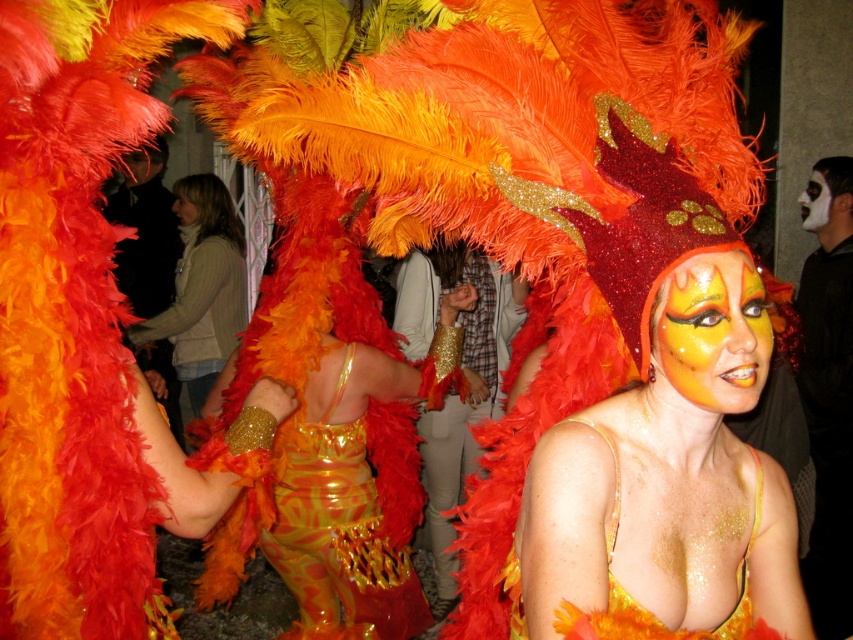
Question: Which of the following is the farthest from the observer?

Choices:
 (A) matte orange feather boa at center
 (B) shiny gold dress at center
 (C) shiny gold costume at center

Answer: (A)

Question: Is shiny gold costume at center in front of matte black face at center?

Choices:
 (A) no
 (B) yes

Answer: (B)

Question: Is shiny gold dress at center thinner than shiny gold face paint at center?

Choices:
 (A) yes
 (B) no

Answer: (B)

Question: Which object is farther from the camera taking this photo?

Choices:
 (A) white matte face at center
 (B) shiny gold dress at center
 (C) shiny gold face paint at center
 (D) shiny gold costume at center

Answer: (A)

Question: Does shiny gold dress at center have a smaller size compared to matte orange feather boa at center?

Choices:
 (A) no
 (B) yes

Answer: (A)

Question: Estimate the real-world distances between objects in this image. Which object is closer to the shiny gold costume at center?

Choices:
 (A) smooth skin face at center
 (B) white matte face at center
 (C) shiny gold face paint at center

Answer: (C)